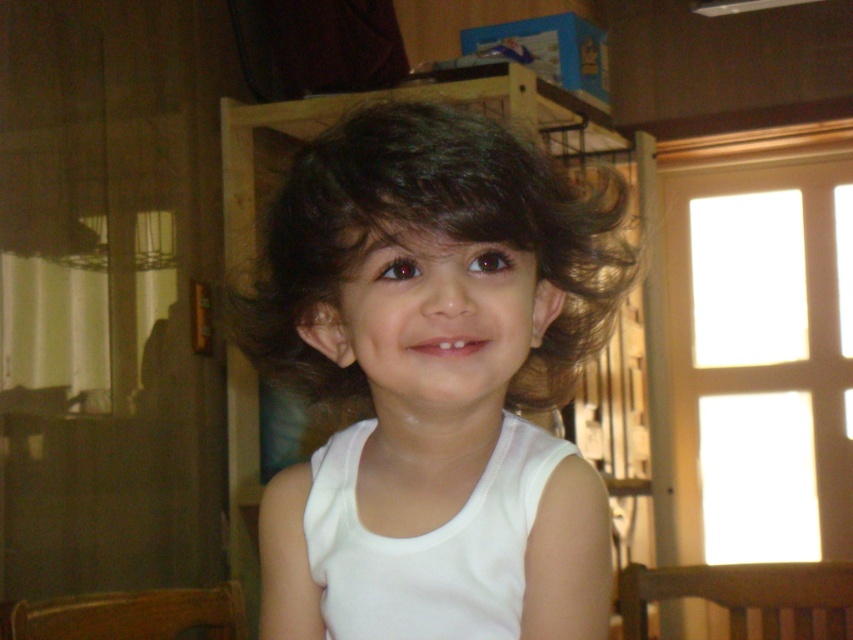
Who is positioned more to the left, white smooth tank top at center or white fabric tank top at center?

Positioned to the left is white fabric tank top at center.

Is white smooth tank top at center positioned behind white fabric tank top at center?

No, it is in front of white fabric tank top at center.

Does point (608, 317) come farther from viewer compared to point (548, 464)?

That is True.

The height and width of the screenshot is (640, 853). Find the location of `white smooth tank top at center`. white smooth tank top at center is located at coordinates (432, 294).